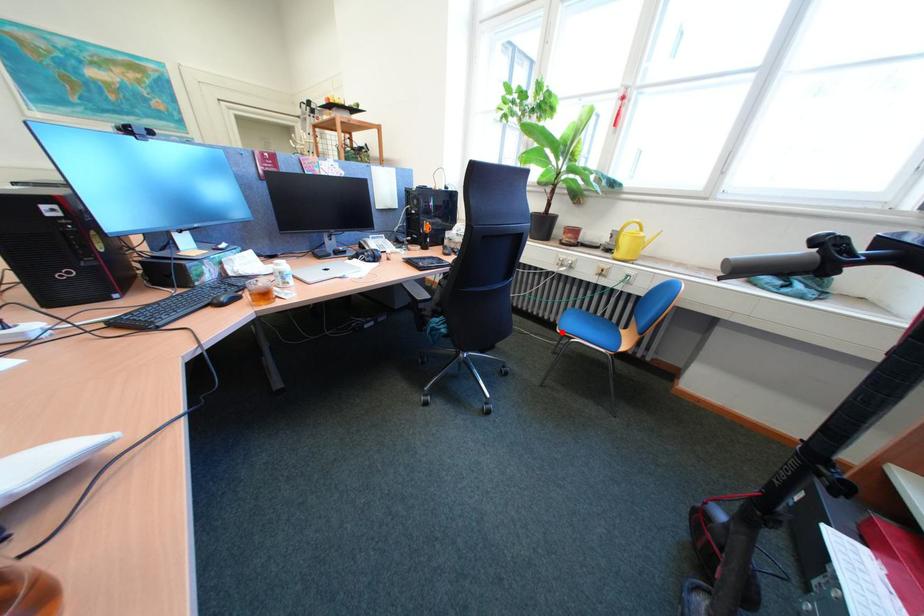
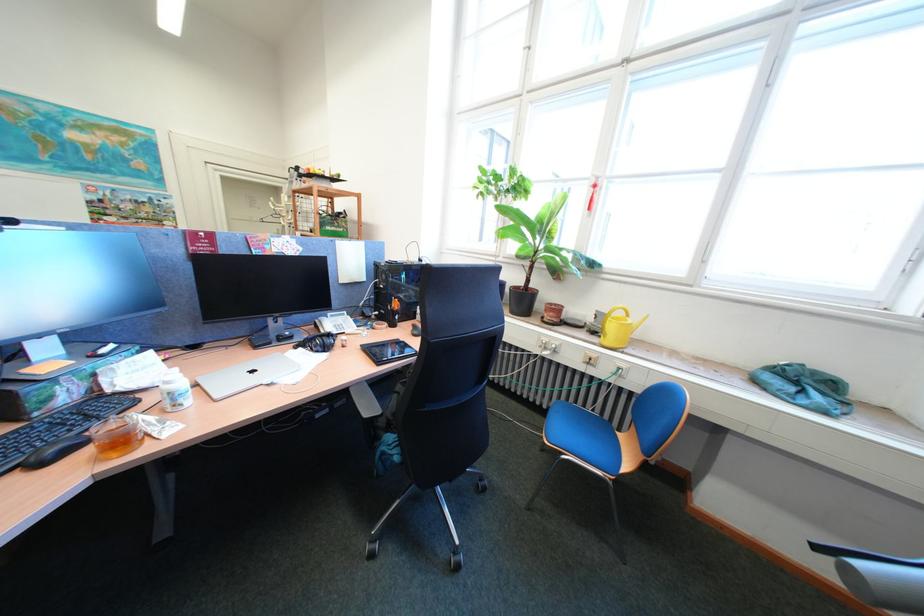
Find the pixel in the second image that matches the highlighted location in the first image.

(548, 416)